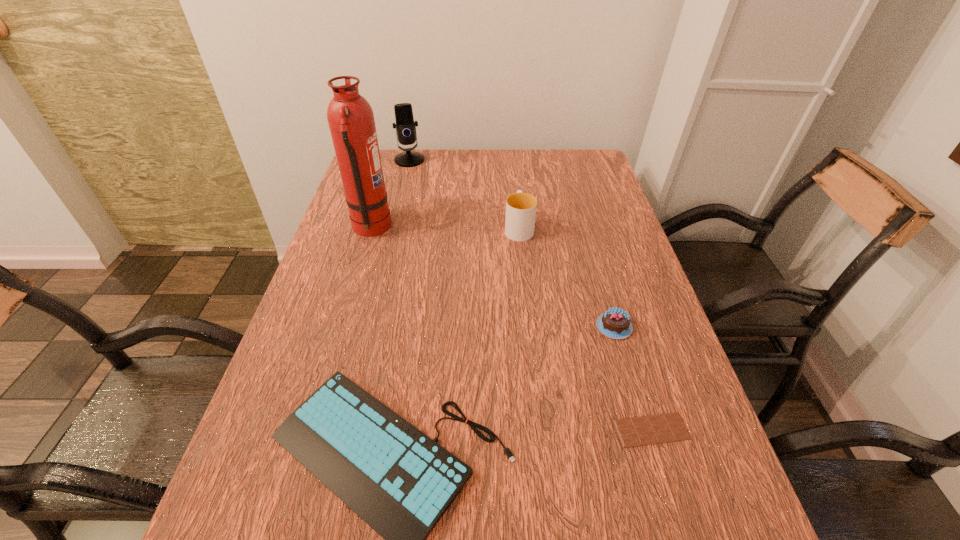
Identify the location of object located in the far left corner section of the desktop. (405, 125).

You are a GUI agent. You are given a task and a screenshot of the screen. Output one action in this format:
    pyautogui.click(x=<x>, y=<y>)
    Task: Click on the vacant space at the far edge
    
    Given the screenshot: What is the action you would take?
    pyautogui.click(x=408, y=177)

Where is `vacant area at the left edge`? The width and height of the screenshot is (960, 540). vacant area at the left edge is located at coordinates (366, 289).

This screenshot has height=540, width=960. I want to click on free spot at the right edge of the desktop, so click(x=606, y=187).

Identify the location of vacant space at the far left corner. The height and width of the screenshot is (540, 960). (402, 168).

In the image, there is a desktop. Where is `vacant space at the far right corner`? Image resolution: width=960 pixels, height=540 pixels. vacant space at the far right corner is located at coordinates (558, 154).

The image size is (960, 540). I want to click on vacant area between the farthest object and the fourth farthest object, so click(x=512, y=244).

Where is `empty space that is in between the fourth object from left to right and the tallest object`? The height and width of the screenshot is (540, 960). empty space that is in between the fourth object from left to right and the tallest object is located at coordinates (445, 228).

Locate an element on the screen. free space between the fire extinguisher and the chocolate cake is located at coordinates (492, 278).

Locate an element on the screen. vacant area that lies between the microphone and the third tallest object is located at coordinates (464, 194).